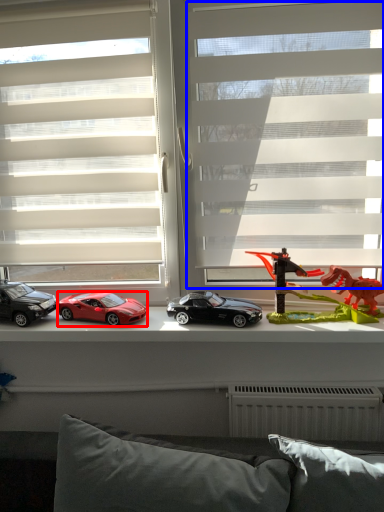
Question: Which object is closer to the camera taking this photo, car (highlighted by a red box) or bay window (highlighted by a blue box)?

Choices:
 (A) car
 (B) bay window

Answer: (B)